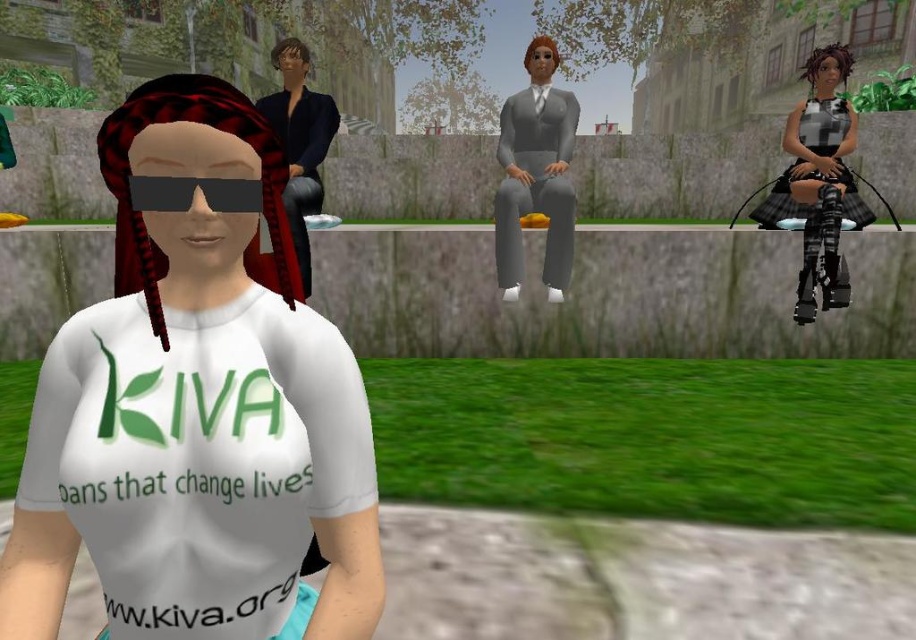
You are standing in the virtual environment and want to move from the point at coordinates point (200, 449) to the point at coordinates point (504, 276). Which direction should you face to walk towards the second point?

You should face away from the viewer because point (504, 276) is further away than point (200, 449).